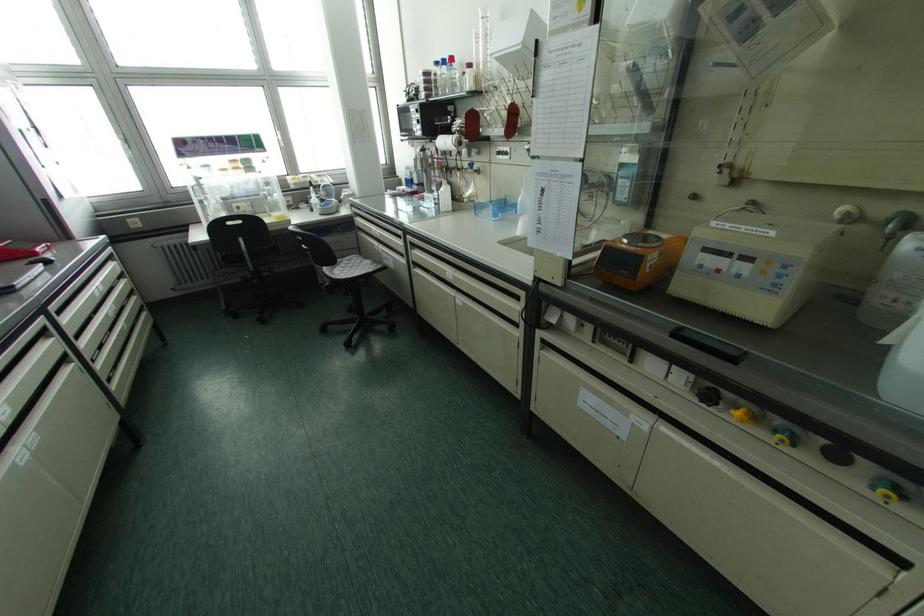
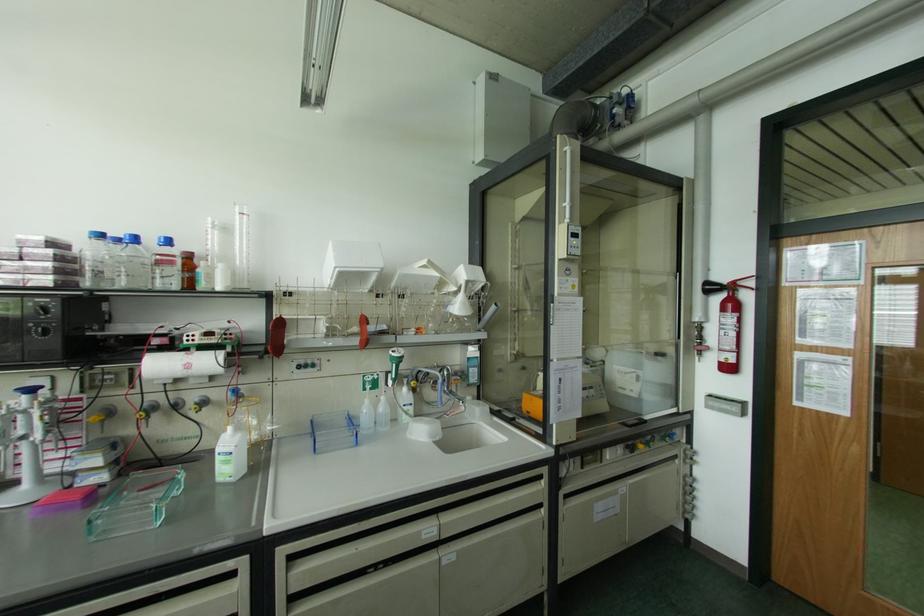
The point at the highlighted location is marked in the first image. Where is the corresponding point in the second image?

(167, 241)